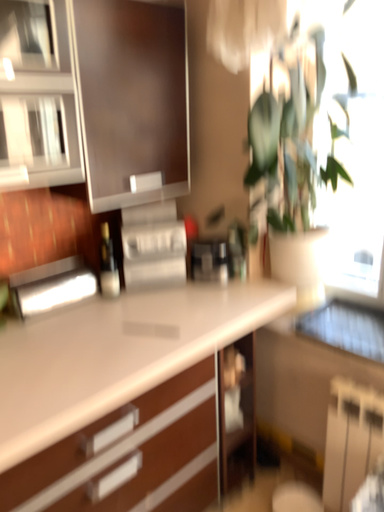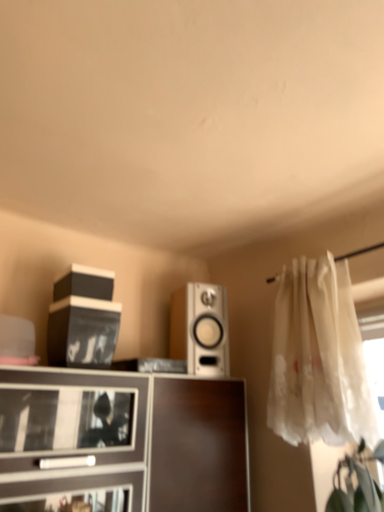
Question: Which way did the camera rotate in the video?

Choices:
 (A) rotated upward
 (B) rotated downward

Answer: (A)